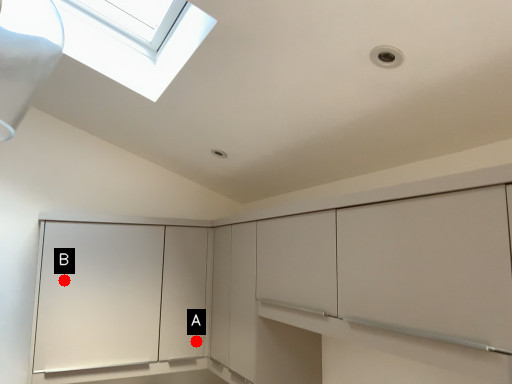
Question: Two points are circled on the image, labeled by A and B beside each circle. Which point appears farthest from the camera in this image?

Choices:
 (A) A is further
 (B) B is further

Answer: (A)